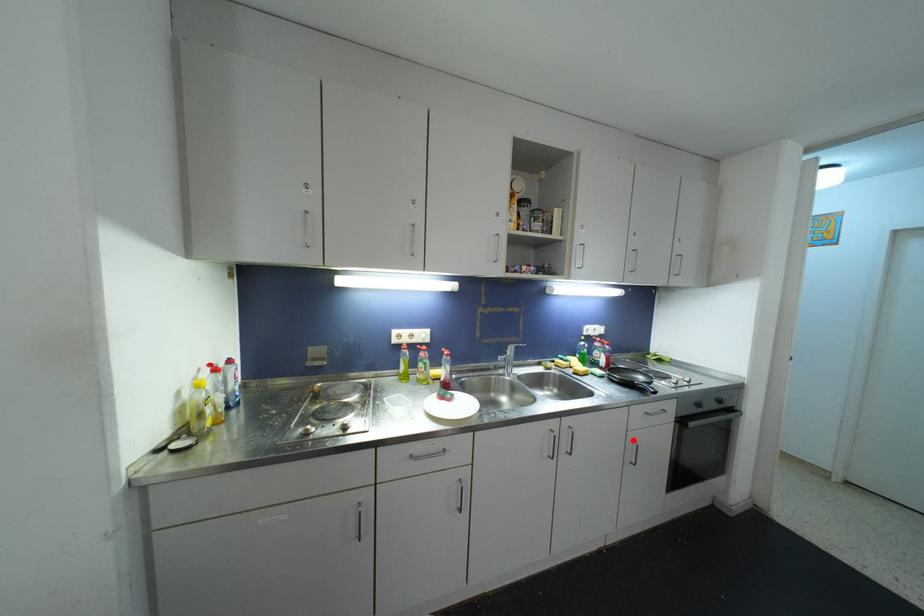
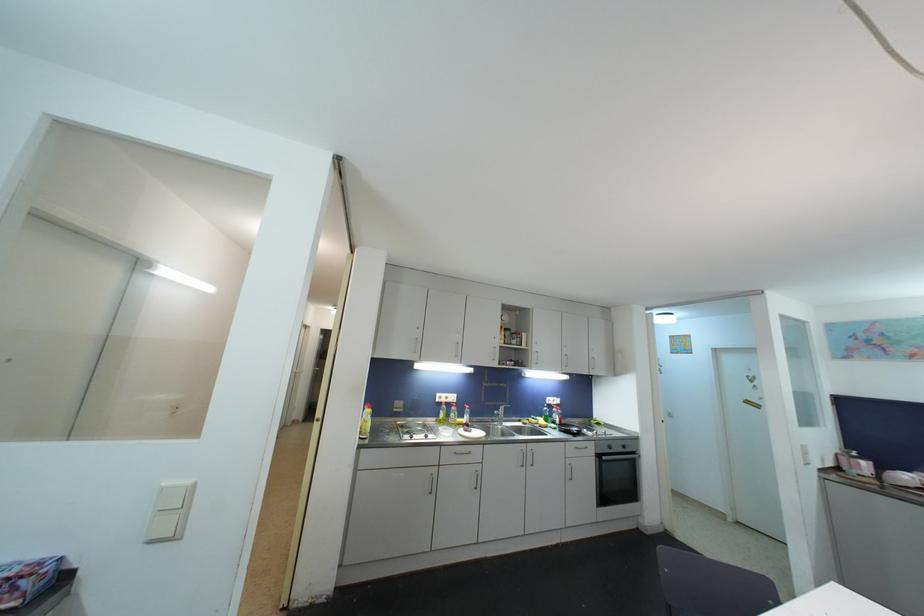
Question: I am providing you with two images of the same scene from different viewpoints. A red point is marked on the first image. Can you still see the location of the red point in image 2?

Choices:
 (A) Yes
 (B) No

Answer: (A)